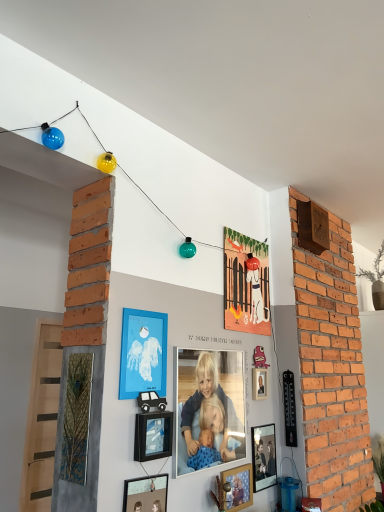
Question: Considering the positions of wooden photo frame at lower center, placed as the third picture frame when sorted from back to front, and matte black picture frame at lower center, arranged as the 1th picture frame when viewed from the front, in the image, is wooden photo frame at lower center, placed as the third picture frame when sorted from back to front, wider or thinner than matte black picture frame at lower center, arranged as the 1th picture frame when viewed from the front,?

Choices:
 (A) wide
 (B) thin

Answer: (A)

Question: Choose the correct answer: Is wooden photo frame at lower center, marked as the fourth picture frame in a front-to-back arrangement, inside matte black picture frame at lower center, arranged as the 1th picture frame when viewed from the front, or outside it?

Choices:
 (A) outside
 (B) inside

Answer: (A)

Question: Considering the real-world distances, which object is farthest from the black matte picture frame at center, the 5th picture frame from the back?

Choices:
 (A) matte black picture frame at lower center, acting as the sixth picture frame starting from the back
 (B) matte paper picture frame at upper center, the sixth picture frame when ordered from front to back
 (C) matte black picture frame at center, the 5th picture frame positioned from the front
 (D) wooden photo frame at lower center, marked as the fourth picture frame in a front-to-back arrangement
 (E) matte blue frame at center, which is the 3th picture frame from front to back

Answer: (B)

Question: Which object is positioned closest to the green leafy plant at upper right?

Choices:
 (A) matte paper picture frame at upper center, acting as the first picture frame starting from the back
 (B) wooden photo frame at lower center, marked as the fourth picture frame in a front-to-back arrangement
 (C) matte black picture frame at lower center, acting as the sixth picture frame starting from the back
 (D) matte blue frame at center, which is the 3th picture frame from front to back
 (E) matte black picture frame at center, the second picture frame positioned from the back

Answer: (A)